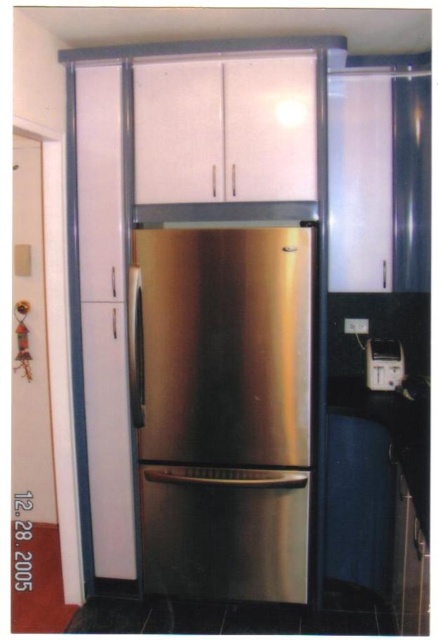
Which is in front, point (246, 516) or point (373, 358)?

Point (246, 516) is in front.

Consider the image. Does stainless steel refrigerator at center appear on the left side of metallic silver toaster at center?

Correct, you'll find stainless steel refrigerator at center to the left of metallic silver toaster at center.

At what (x,y) coordinates should I click in order to perform the action: click on stainless steel refrigerator at center. Please return your answer as a coordinate pair (x, y). The image size is (438, 640). Looking at the image, I should click on (226, 410).